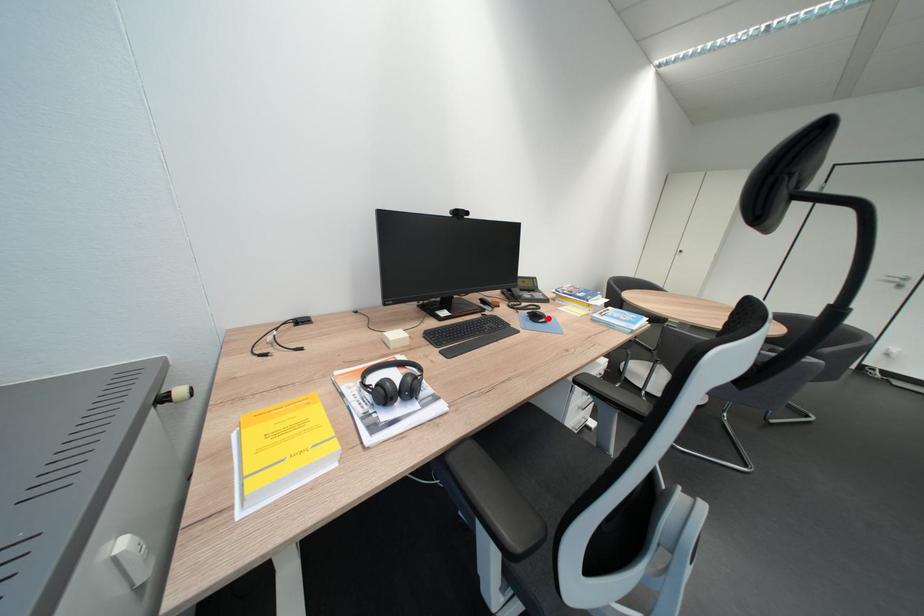
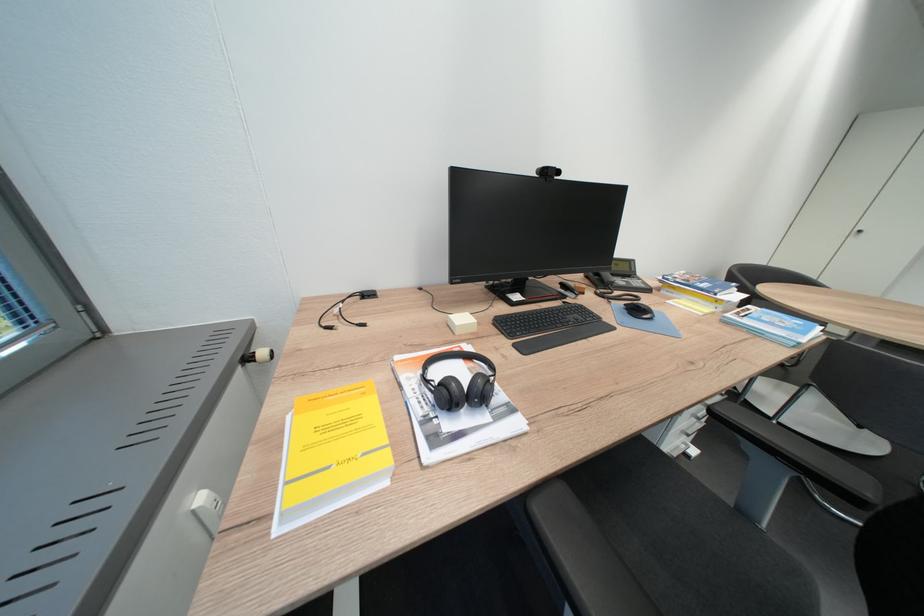
Find the pixel in the second image that matches the highlighted location in the first image.

(650, 313)